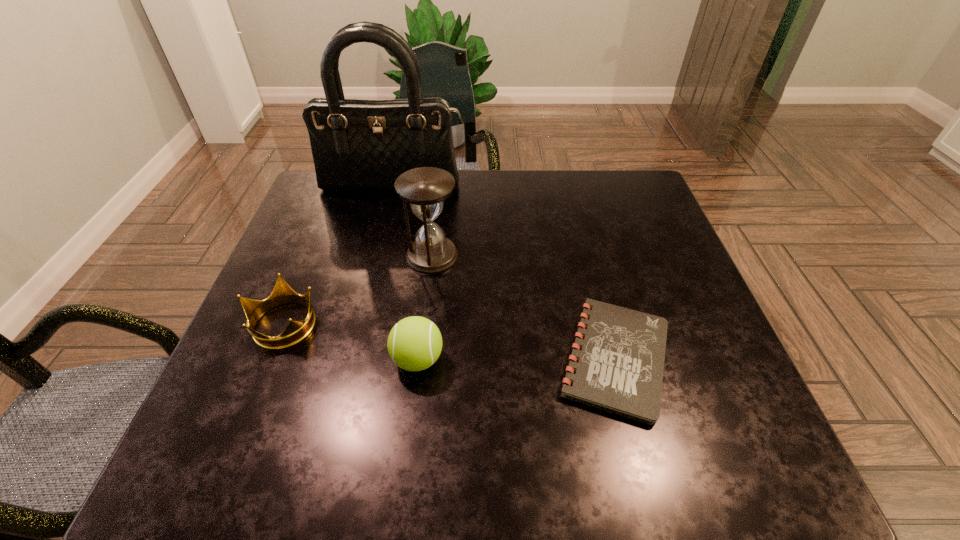
This screenshot has height=540, width=960. Find the location of `free location that satisfies the following two spatial constraints: 1. with an open clasp on the front of the farthest object; 2. on the right side of the third tallest object`. free location that satisfies the following two spatial constraints: 1. with an open clasp on the front of the farthest object; 2. on the right side of the third tallest object is located at coordinates (350, 359).

The height and width of the screenshot is (540, 960). I want to click on vacant space that satisfies the following two spatial constraints: 1. with an open clasp on the front of the fourth shortest object; 2. on the left side of the farthest object, so click(x=376, y=256).

Where is `blank space that satisfies the following two spatial constraints: 1. with an open clasp on the front of the farthest object; 2. on the left side of the fourth nearest object`? Image resolution: width=960 pixels, height=540 pixels. blank space that satisfies the following two spatial constraints: 1. with an open clasp on the front of the farthest object; 2. on the left side of the fourth nearest object is located at coordinates (376, 256).

Locate an element on the screen. vacant space that satisfies the following two spatial constraints: 1. on the front side of the notebook; 2. on the left side of the fourth tallest object is located at coordinates (270, 359).